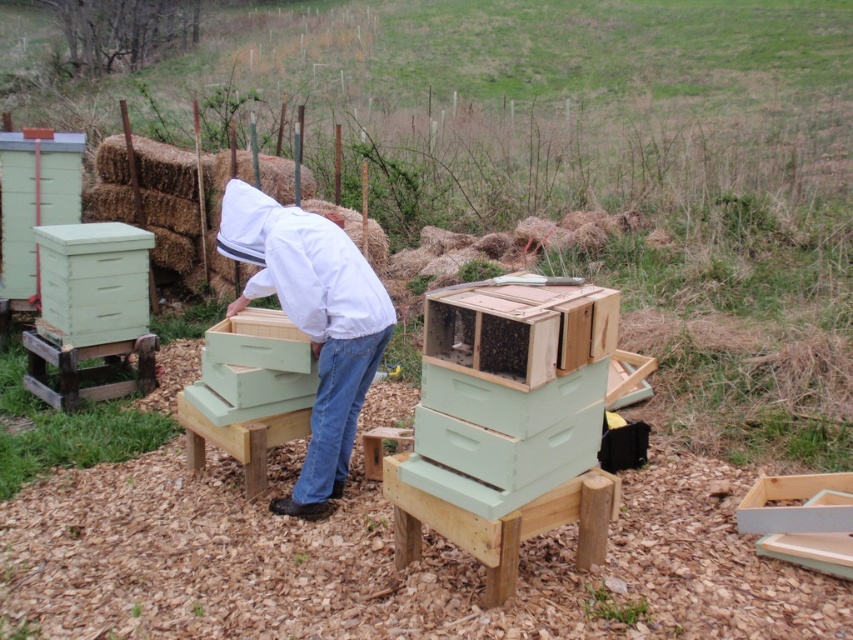
Does light green wooden beehive at center have a lesser width compared to white matte beekeeper suit at center?

Yes.

Who is shorter, light green wooden beehive at center or white matte beekeeper suit at center?

Standing shorter between the two is light green wooden beehive at center.

Locate an element on the screen. This screenshot has width=853, height=640. light green wooden beehive at center is located at coordinates (509, 388).

What are the coordinates of `light green wooden beehive at center` in the screenshot? It's located at (509, 388).